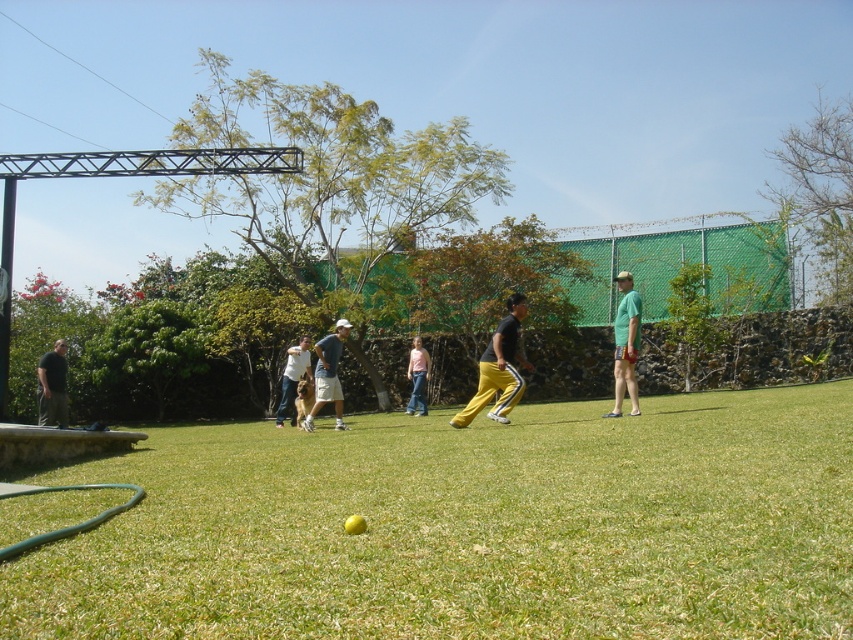
You are standing in the park and see two people wearing the green matte shirt at center and the dark gray shirt at left. Which one is positioned more to the right side of the scene?

The green matte shirt at center is positioned more to the right side of the scene than the dark gray shirt at left.

You are standing in the park and see the green grass at center and the dark gray shirt at left. Which one is higher from the ground?

The green grass at center is higher from the ground than the dark gray shirt at left because the green grass at center is above dark gray shirt at left.